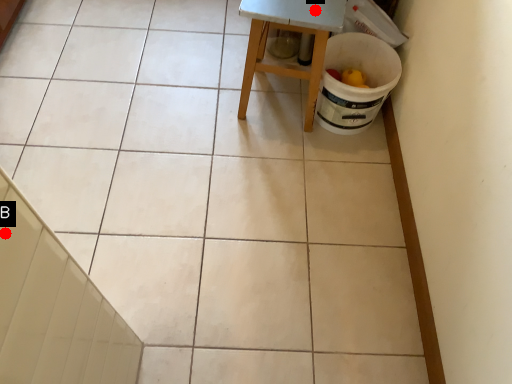
Question: Two points are circled on the image, labeled by A and B beside each circle. Which of the following is the farthest from the observer?

Choices:
 (A) A is further
 (B) B is further

Answer: (A)